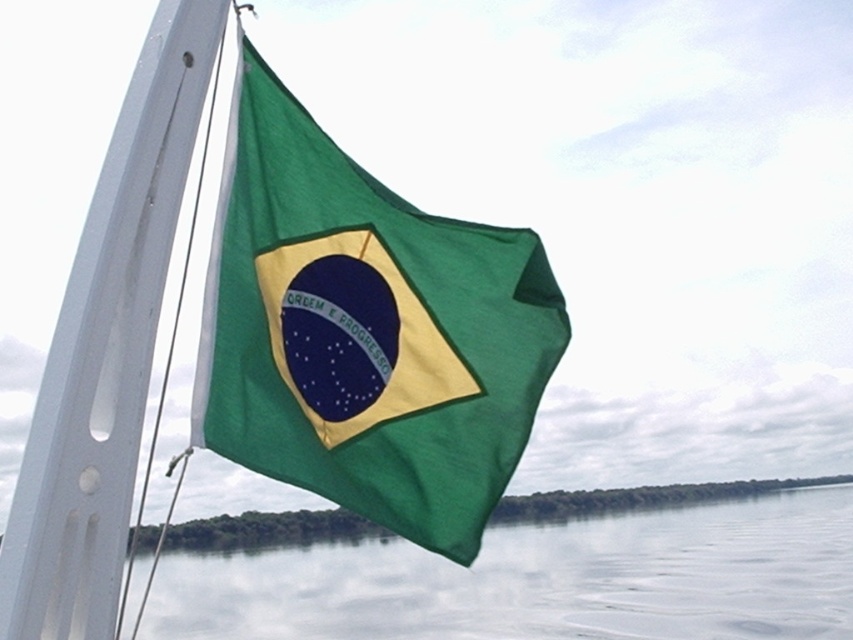
Based on the photo, between green fabric flag at center and transparent water at lower center, which one appears on the right side from the viewer's perspective?

Positioned to the right is transparent water at lower center.

Does green fabric flag at center appear on the left side of transparent water at lower center?

Yes, green fabric flag at center is to the left of transparent water at lower center.

Is point (508, 413) in front of point (328, 573)?

Yes.

Image resolution: width=853 pixels, height=640 pixels. Find the location of `green fabric flag at center`. green fabric flag at center is located at coordinates (364, 332).

Between green fabric flag at center and white matte flag pole at left, which one is positioned higher?

Positioned higher is white matte flag pole at left.

Can you confirm if green fabric flag at center is shorter than white matte flag pole at left?

No, green fabric flag at center is not shorter than white matte flag pole at left.

Is point (485, 433) farther from camera compared to point (154, 172)?

Yes, point (485, 433) is behind point (154, 172).

Locate an element on the screen. green fabric flag at center is located at coordinates (364, 332).

This screenshot has height=640, width=853. What do you see at coordinates (540, 579) in the screenshot?
I see `transparent water at lower center` at bounding box center [540, 579].

Which is more to the right, transparent water at lower center or white matte flag pole at left?

From the viewer's perspective, transparent water at lower center appears more on the right side.

Locate an element on the screen. The height and width of the screenshot is (640, 853). transparent water at lower center is located at coordinates (540, 579).